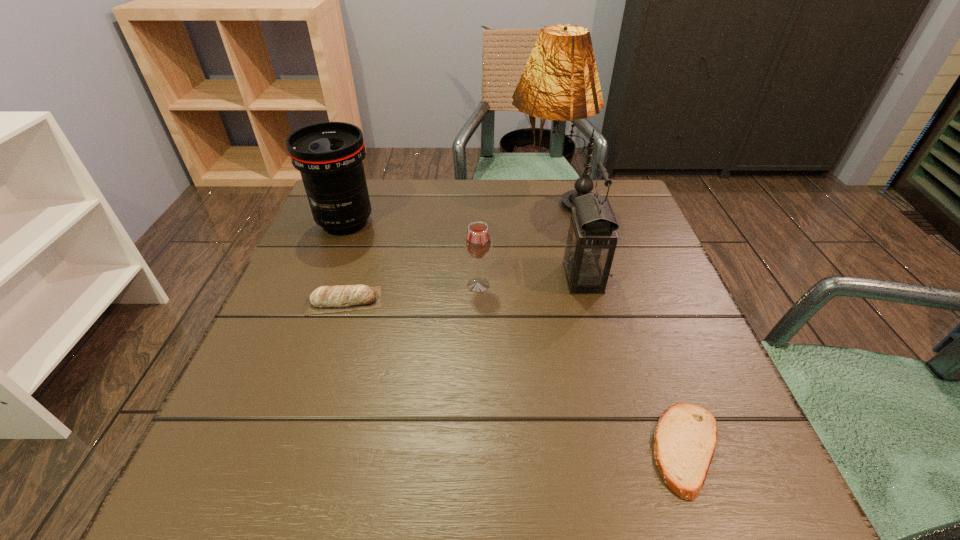
The width and height of the screenshot is (960, 540). I want to click on telephoto lens present at the far edge, so click(329, 155).

This screenshot has height=540, width=960. Identify the location of object present at the near edge. (685, 437).

Locate an element on the screen. The height and width of the screenshot is (540, 960). telephoto lens present at the left edge is located at coordinates (329, 155).

The width and height of the screenshot is (960, 540). Identify the location of pita bread situated at the left edge. (326, 299).

The image size is (960, 540). What are the coordinates of `lampshade that is at the right edge` in the screenshot? It's located at (560, 81).

Where is `lantern situated at the right edge`? The width and height of the screenshot is (960, 540). lantern situated at the right edge is located at coordinates (591, 239).

Where is `pita bread that is at the right edge`? This screenshot has height=540, width=960. pita bread that is at the right edge is located at coordinates (685, 437).

Locate an element on the screen. Image resolution: width=960 pixels, height=540 pixels. object that is at the far left corner is located at coordinates (329, 155).

Where is `object at the far right corner`? The image size is (960, 540). object at the far right corner is located at coordinates (560, 81).

This screenshot has width=960, height=540. What are the coordinates of `object that is at the near right corner` in the screenshot? It's located at (685, 437).